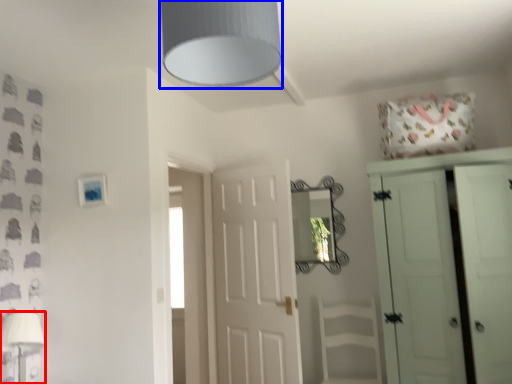
Question: Which object is closer to the camera taking this photo, table lamp (highlighted by a red box) or light fixture (highlighted by a blue box)?

Choices:
 (A) table lamp
 (B) light fixture

Answer: (B)